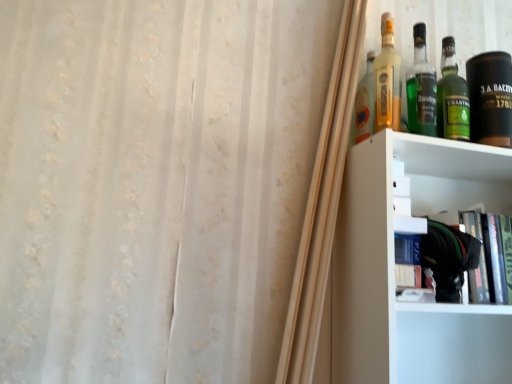
Question: Can you confirm if hardcover book at upper right is shorter than translucent glass bottle at upper right, marked as the 3th bottle in a right-to-left arrangement?

Choices:
 (A) no
 (B) yes

Answer: (B)

Question: From the image's perspective, does hardcover book at upper right appear lower than translucent glass bottle at upper right, marked as the 3th bottle in a right-to-left arrangement?

Choices:
 (A) no
 (B) yes

Answer: (B)

Question: Is hardcover book at upper right closer to camera compared to translucent glass bottle at upper right, the 2th bottle positioned from the left?

Choices:
 (A) no
 (B) yes

Answer: (B)

Question: Does hardcover book at upper right have a greater width compared to translucent glass bottle at upper right, the 2th bottle positioned from the left?

Choices:
 (A) yes
 (B) no

Answer: (A)

Question: Is hardcover book at upper right beside translucent glass bottle at upper right, the 2th bottle positioned from the left?

Choices:
 (A) no
 (B) yes

Answer: (A)

Question: From the image's perspective, is green glass bottle at upper right, the 3th bottle from the left, above or below black leather canister at upper right?

Choices:
 (A) below
 (B) above

Answer: (B)

Question: Considering their positions, is green glass bottle at upper right, the second bottle from the right, located in front of or behind black leather canister at upper right?

Choices:
 (A) behind
 (B) front

Answer: (B)

Question: Considering the positions of point (433, 96) and point (482, 97), is point (433, 96) closer or farther from the camera than point (482, 97)?

Choices:
 (A) farther
 (B) closer

Answer: (B)

Question: Considering the positions of green glass bottle at upper right, the 3th bottle from the left, and black leather canister at upper right in the image, is green glass bottle at upper right, the 3th bottle from the left, wider or thinner than black leather canister at upper right?

Choices:
 (A) thin
 (B) wide

Answer: (A)

Question: Is translucent glass bottle at upper right, the 2th bottle positioned from the left, bigger or smaller than green glass bottle at upper right, the first bottle viewed from the right?

Choices:
 (A) big
 (B) small

Answer: (A)

Question: Considering the positions of translucent glass bottle at upper right, marked as the 3th bottle in a right-to-left arrangement, and green glass bottle at upper right, the first bottle viewed from the right, in the image, is translucent glass bottle at upper right, marked as the 3th bottle in a right-to-left arrangement, taller or shorter than green glass bottle at upper right, the first bottle viewed from the right,?

Choices:
 (A) short
 (B) tall

Answer: (B)

Question: From a real-world perspective, is translucent glass bottle at upper right, the 2th bottle positioned from the left, above or below green glass bottle at upper right, acting as the 4th bottle starting from the left?

Choices:
 (A) above
 (B) below

Answer: (A)

Question: Considering the positions of translucent glass bottle at upper right, marked as the 3th bottle in a right-to-left arrangement, and green glass bottle at upper right, acting as the 4th bottle starting from the left, in the image, is translucent glass bottle at upper right, marked as the 3th bottle in a right-to-left arrangement, wider or thinner than green glass bottle at upper right, acting as the 4th bottle starting from the left,?

Choices:
 (A) thin
 (B) wide

Answer: (B)

Question: Looking at their shapes, would you say green glass bottle at upper right, the 3th bottle from the left, is wider or thinner than hardcover book at upper right?

Choices:
 (A) thin
 (B) wide

Answer: (A)

Question: Visually, is green glass bottle at upper right, the 3th bottle from the left, positioned to the left or to the right of hardcover book at upper right?

Choices:
 (A) right
 (B) left

Answer: (B)